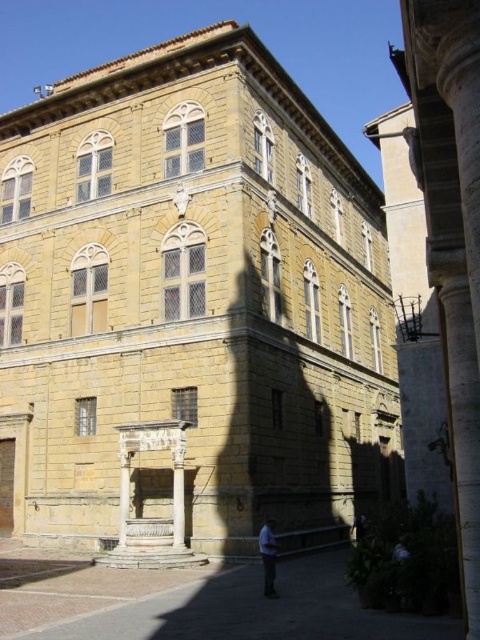
Consider the image. Can you confirm if smooth stone pillar at right is positioned below blue fabric shirt at lower center?

Incorrect, smooth stone pillar at right is not positioned below blue fabric shirt at lower center.

Between smooth stone pillar at right and blue fabric shirt at lower center, which one has more height?

With more height is smooth stone pillar at right.

Where is `smooth stone pillar at right`? Image resolution: width=480 pixels, height=640 pixels. smooth stone pillar at right is located at coordinates (453, 234).